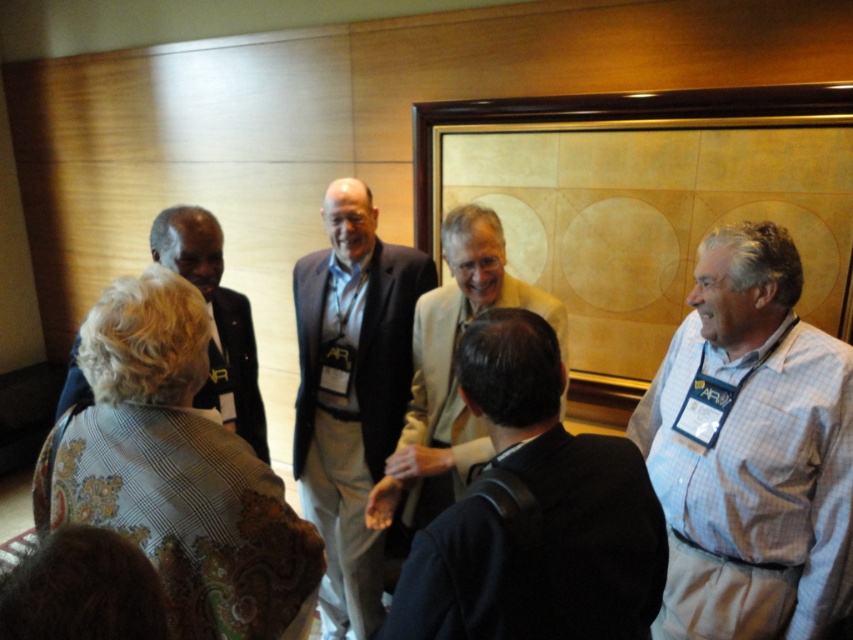
Is white checkered shirt at right bigger than dark blue suit at center?

No, white checkered shirt at right is not bigger than dark blue suit at center.

Can you confirm if white checkered shirt at right is taller than dark blue suit at center?

Incorrect, white checkered shirt at right's height is not larger of dark blue suit at center's.

The image size is (853, 640). I want to click on white checkered shirt at right, so click(750, 451).

Does dark blue sweater at center appear on the left side of dark blue suit at center?

No, dark blue sweater at center is not to the left of dark blue suit at center.

Is dark blue sweater at center bigger than dark blue suit at center?

Actually, dark blue sweater at center might be smaller than dark blue suit at center.

You are a GUI agent. You are given a task and a screenshot of the screen. Output one action in this format:
    pyautogui.click(x=<x>, y=<y>)
    Task: Click on the dark blue sweater at center
    This screenshot has width=853, height=640.
    Given the screenshot: What is the action you would take?
    pyautogui.click(x=532, y=513)

In the scene shown: Who is higher up, dark blue suit at center or light beige suit at center?

dark blue suit at center is higher up.

Describe the element at coordinates (351, 394) in the screenshot. This screenshot has height=640, width=853. I see `dark blue suit at center` at that location.

The height and width of the screenshot is (640, 853). Identify the location of dark blue suit at center. (351, 394).